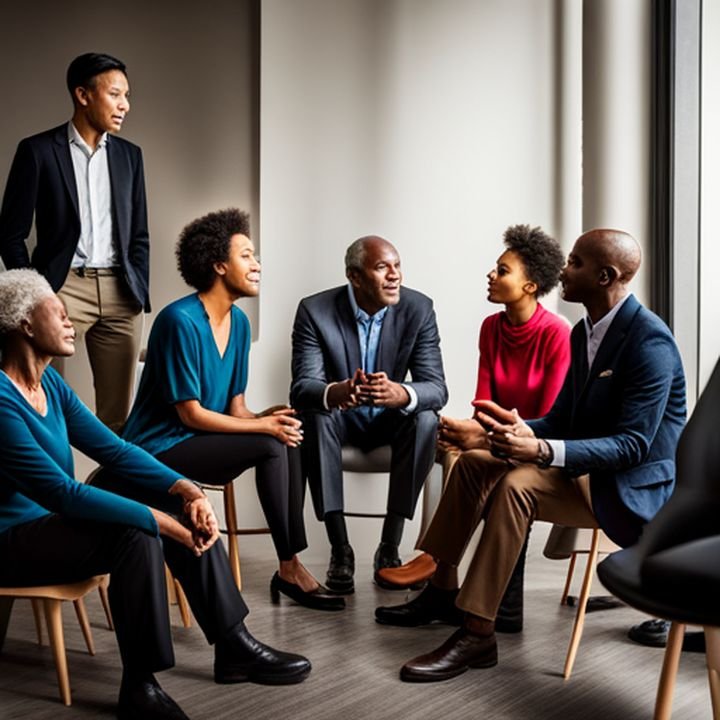
This screenshot has height=720, width=720. Identify the location of chairs. (629, 572), (571, 536), (378, 459), (225, 487), (72, 595).